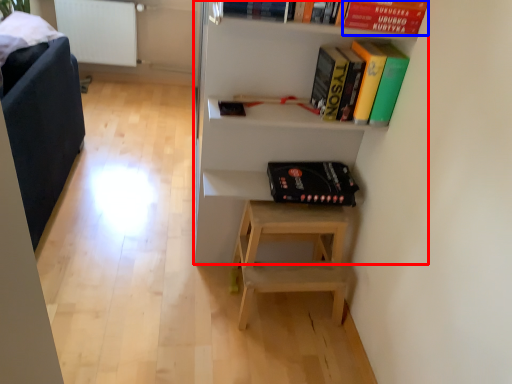
Question: Which object appears farthest to the camera in this image, shelf (highlighted by a red box) or paperback book (highlighted by a blue box)?

Choices:
 (A) shelf
 (B) paperback book

Answer: (B)